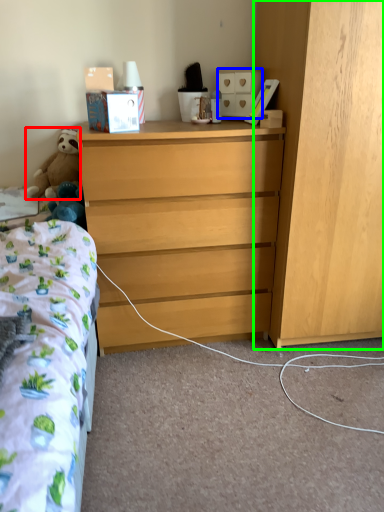
Question: Which is nearer to the teddy bear (highlighted by a red box)? cabinetry (highlighted by a blue box) or cabinetry (highlighted by a green box).

Choices:
 (A) cabinetry
 (B) cabinetry

Answer: (A)